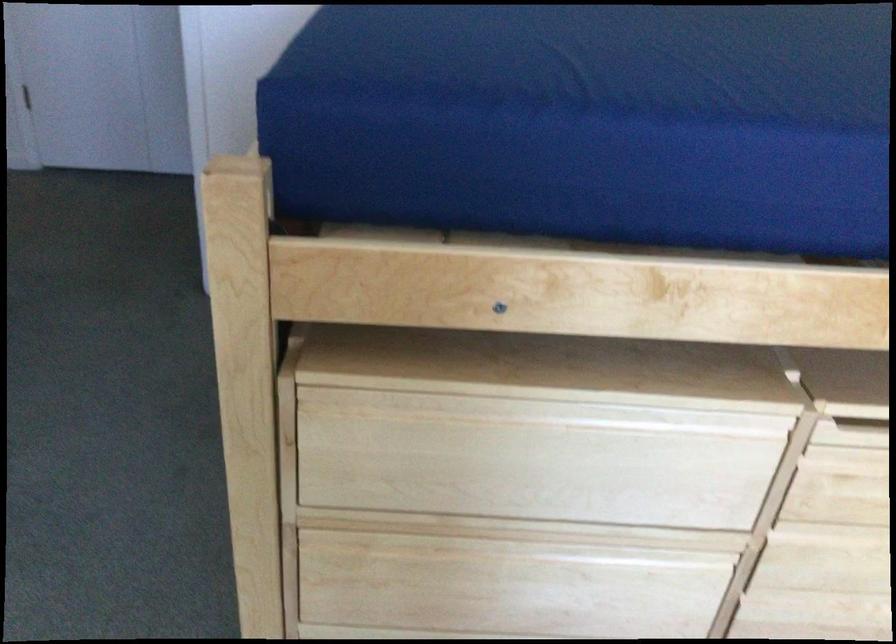
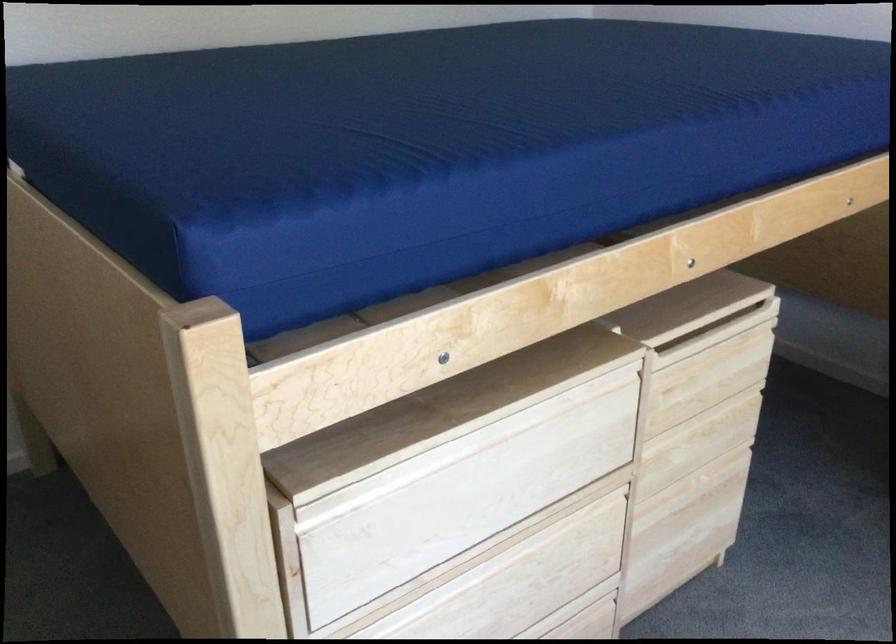
Question: How did the camera likely rotate?

Choices:
 (A) Left
 (B) Right
 (C) Up
 (D) Down

Answer: (B)